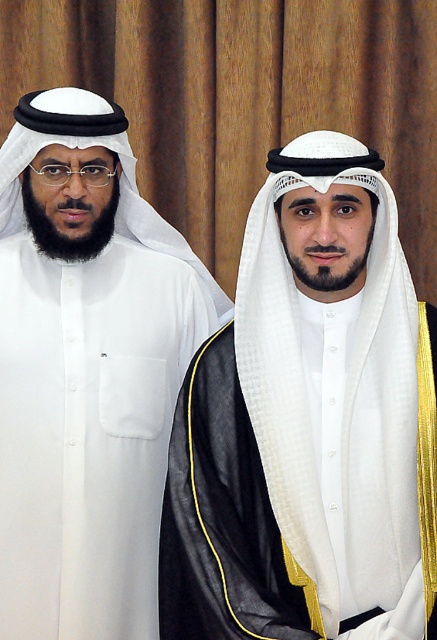
You are a photographer setting up a shoot in front of a wooden panel curtain. You need to position two models wearing traditional attire. The first model is wearing a white matte kandura at left, and the second model is wearing a white matte headscarf at center. Based on the scene description, which model is positioned to the right of the other?

The white matte headscarf at center is positioned to the right of the white matte kandura at left.

You are a photographer setting up for a portrait. You have two items to place in the scene according to the image description. The first is a white matte headscarf at center and the second is a white matte kandura at left. The headscarf needs to be positioned so it doesn not block the subject. Given the size difference mentioned, will the headscarf at center cover more area than the kandura at left?

The white matte headscarf at center has a larger width than the white matte kandura at left, so yes, the headscarf will cover more area than the kandura.